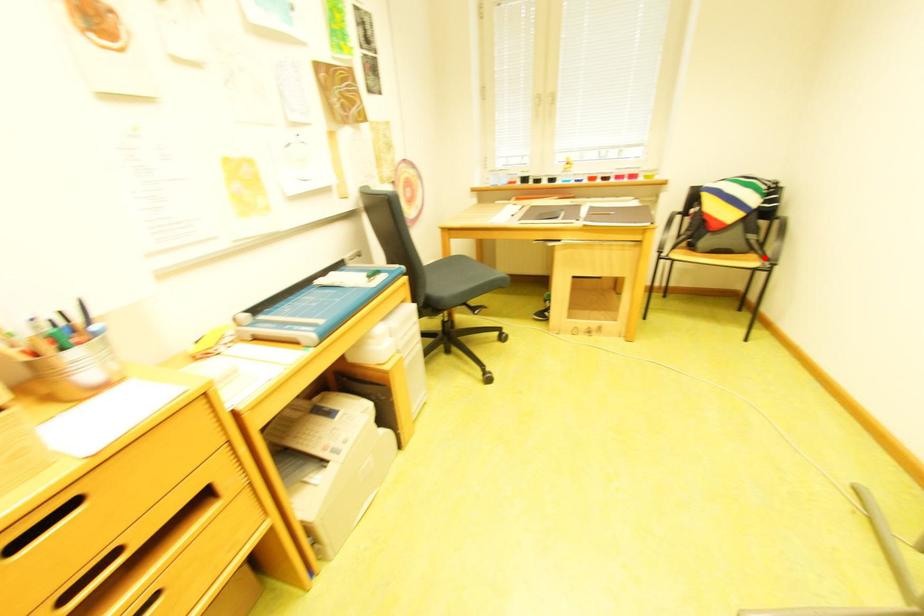
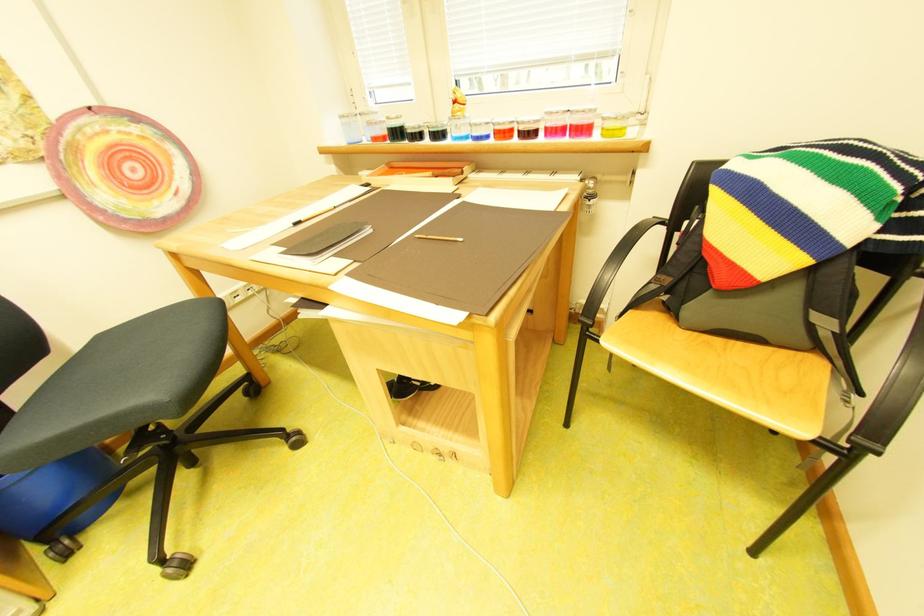
Find the pixel in the second image that matches the highlighted location in the first image.

(829, 367)